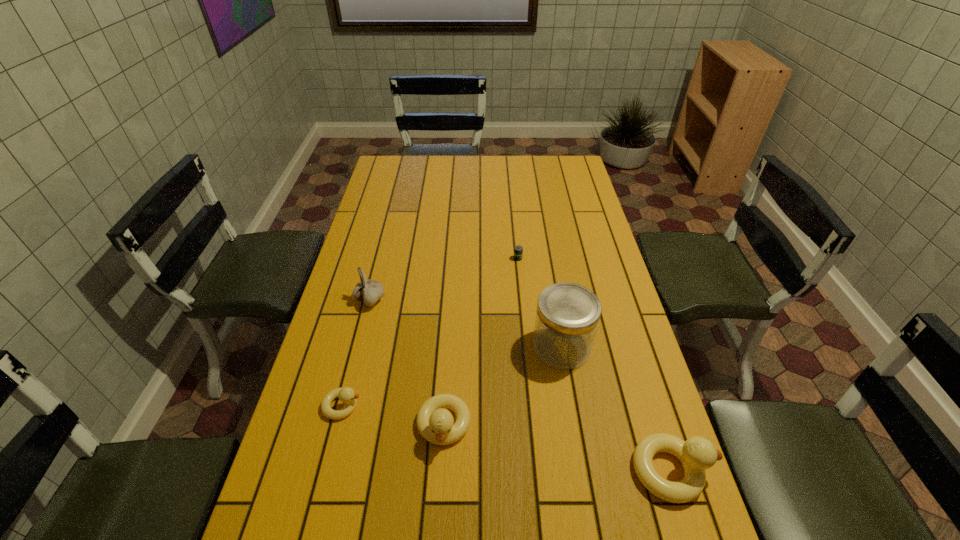
Where is `free space between the farthest object and the rightmost object`? The height and width of the screenshot is (540, 960). free space between the farthest object and the rightmost object is located at coordinates (594, 364).

Find the location of `vacant area between the shortest duckling and the fourth nearest object`. vacant area between the shortest duckling and the fourth nearest object is located at coordinates (452, 376).

The image size is (960, 540). I want to click on free spot between the tallest object and the garlic, so click(466, 323).

You are a GUI agent. You are given a task and a screenshot of the screen. Output one action in this format:
    pyautogui.click(x=<x>, y=<y>)
    Task: Click on the free space between the second duckling from left to right and the farthest object
    The width and height of the screenshot is (960, 540).
    Given the screenshot: What is the action you would take?
    pyautogui.click(x=481, y=342)

You are a GUI agent. You are given a task and a screenshot of the screen. Output one action in this format:
    pyautogui.click(x=<x>, y=<y>)
    Task: Click on the free space between the second duckling from right to left and the rightmost duckling
    
    Given the screenshot: What is the action you would take?
    pyautogui.click(x=558, y=448)

The height and width of the screenshot is (540, 960). I want to click on free space between the second duckling from left to right and the shortest duckling, so click(393, 416).

This screenshot has height=540, width=960. I want to click on object that is the fifth nearest to the leftmost duckling, so click(x=697, y=454).

In order to click on the fifth closest object to the third object from left to right in this screenshot , I will do `click(518, 251)`.

This screenshot has width=960, height=540. I want to click on duckling that is the second closest to the third object from left to right, so click(697, 454).

The width and height of the screenshot is (960, 540). I want to click on duckling object that ranks as the second closest to the rightmost duckling, so click(x=346, y=395).